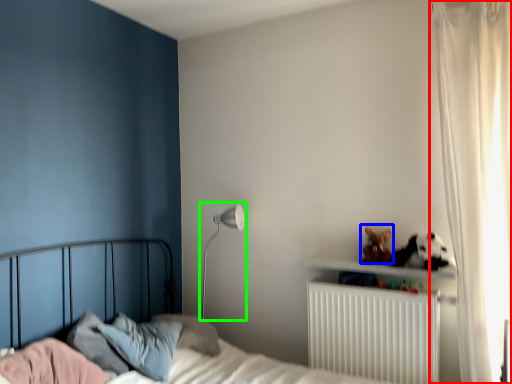
Question: Considering the real-world distances, which object is farthest from curtain (highlighted by a red box)? stuff (highlighted by a blue box) or table lamp (highlighted by a green box)?

Choices:
 (A) stuff
 (B) table lamp

Answer: (B)